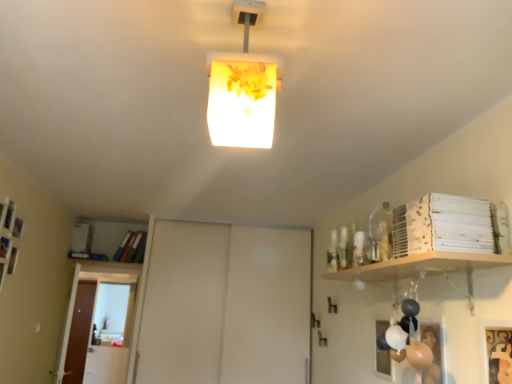
Question: Is white matte sliding door at center, marked as the second door in a back-to-front arrangement, at the right side of brown wooden door at left, the 2th door positioned from the right?

Choices:
 (A) yes
 (B) no

Answer: (A)

Question: Is white matte sliding door at center, which is the first door from right to left, turned away from brown wooden door at left, the first door viewed from the left?

Choices:
 (A) no
 (B) yes

Answer: (A)

Question: Can you confirm if white matte sliding door at center, the 2th door from the left, is thinner than brown wooden door at left, the first door in the back-to-front sequence?

Choices:
 (A) yes
 (B) no

Answer: (B)

Question: From the image's perspective, would you say white matte sliding door at center, which is the first door from right to left, is positioned over brown wooden door at left, the first door viewed from the left?

Choices:
 (A) yes
 (B) no

Answer: (A)

Question: Does white matte sliding door at center, which is the first door from right to left, come in front of brown wooden door at left, the 2th door positioned from the right?

Choices:
 (A) yes
 (B) no

Answer: (A)

Question: Is white matte sliding door at center, marked as the second door in a back-to-front arrangement, far from brown wooden door at left, the second door positioned from the front?

Choices:
 (A) yes
 (B) no

Answer: (A)

Question: From the image's perspective, is brown wooden door at left, the first door in the back-to-front sequence, on gold textured picture frame at lower right?

Choices:
 (A) yes
 (B) no

Answer: (B)

Question: Is brown wooden door at left, the first door viewed from the left, positioned before gold textured picture frame at lower right?

Choices:
 (A) no
 (B) yes

Answer: (A)

Question: Is brown wooden door at left, the first door viewed from the left, oriented away from gold textured picture frame at lower right?

Choices:
 (A) no
 (B) yes

Answer: (A)

Question: Is brown wooden door at left, the second door positioned from the front, to the left of gold textured picture frame at lower right from the viewer's perspective?

Choices:
 (A) yes
 (B) no

Answer: (A)

Question: Can we say brown wooden door at left, the second door positioned from the front, lies outside gold textured picture frame at lower right?

Choices:
 (A) yes
 (B) no

Answer: (A)

Question: Does brown wooden door at left, the second door positioned from the front, touch gold textured picture frame at lower right?

Choices:
 (A) yes
 (B) no

Answer: (B)

Question: Can you confirm if white matte sliding door at center, which is the first door from right to left, is taller than translucent floral-patterned lampshade at center?

Choices:
 (A) no
 (B) yes

Answer: (B)